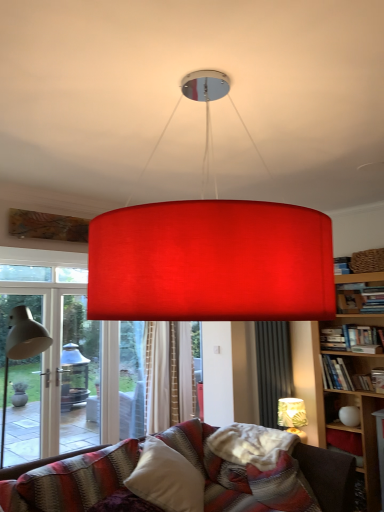
Question: Relative to matte red lampshade at center, which is the second lamp in back-to-front order, is matte white table lamp at left in front or behind?

Choices:
 (A) front
 (B) behind

Answer: (B)

Question: Is matte white table lamp at left inside or outside of matte red lampshade at center, which is the second lamp in back-to-front order?

Choices:
 (A) outside
 (B) inside

Answer: (A)

Question: Which of these objects is positioned farthest from the matte red lampshade at center, which appears as the first lamp when viewed from the front?

Choices:
 (A) matte white table lamp at left
 (B) white textured lampshade at lower right, which is the first lamp from back to front

Answer: (B)

Question: Which is farther from the white textured lampshade at lower right, arranged as the second lamp when viewed from the top?

Choices:
 (A) matte red lampshade at center, which is the second lamp in back-to-front order
 (B) matte white table lamp at left

Answer: (A)